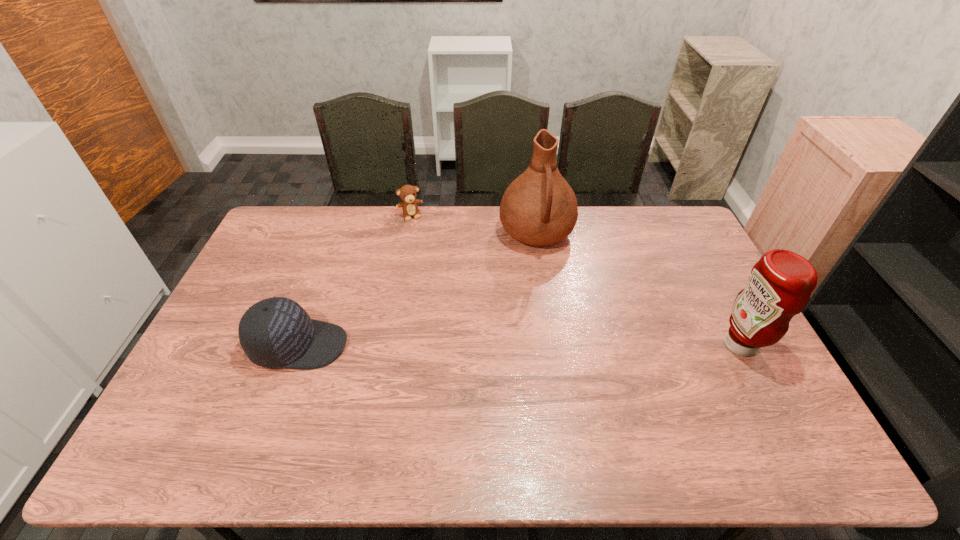
Locate an element on the screen. Image resolution: width=960 pixels, height=540 pixels. free point between the teddy bear and the pitcher is located at coordinates (473, 225).

What are the coordinates of `empty space that is in between the rightmost object and the baseball cap` in the screenshot? It's located at (519, 345).

In order to click on free space between the third tallest object and the tallest object in this screenshot , I will do `click(418, 289)`.

Image resolution: width=960 pixels, height=540 pixels. I want to click on free space between the leftmost object and the teddy bear, so click(355, 280).

Locate an element on the screen. This screenshot has height=540, width=960. free point between the baseball cap and the rightmost object is located at coordinates (519, 345).

What are the coordinates of `object that is the second closest one to the leftmost object` in the screenshot? It's located at (539, 208).

The width and height of the screenshot is (960, 540). Identify the location of object that is the second closest to the second object from right to left. (x=780, y=284).

Image resolution: width=960 pixels, height=540 pixels. In order to click on vacant position in the image that satisfies the following two spatial constraints: 1. on the front side of the tallest object; 2. on the left side of the rightmost object in this screenshot , I will do `click(553, 345)`.